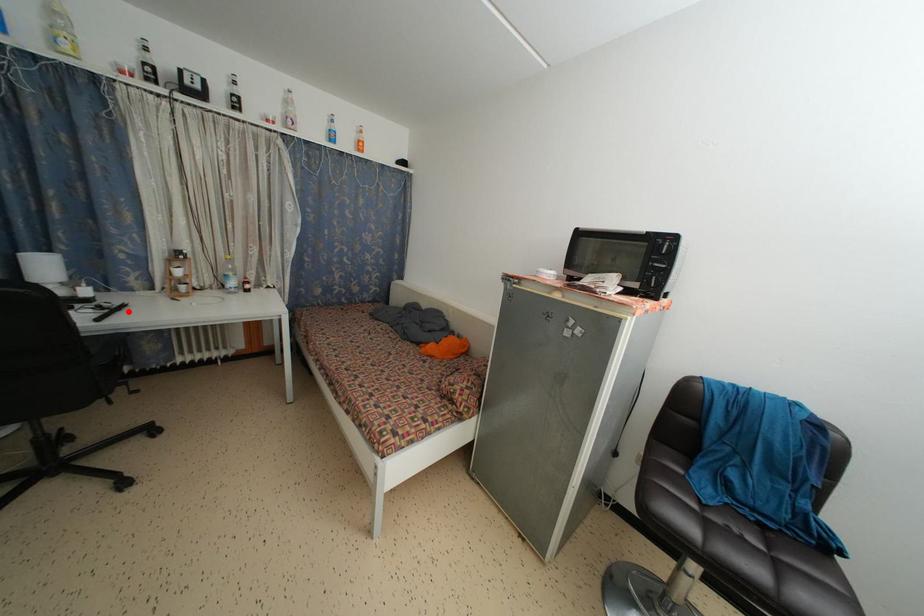
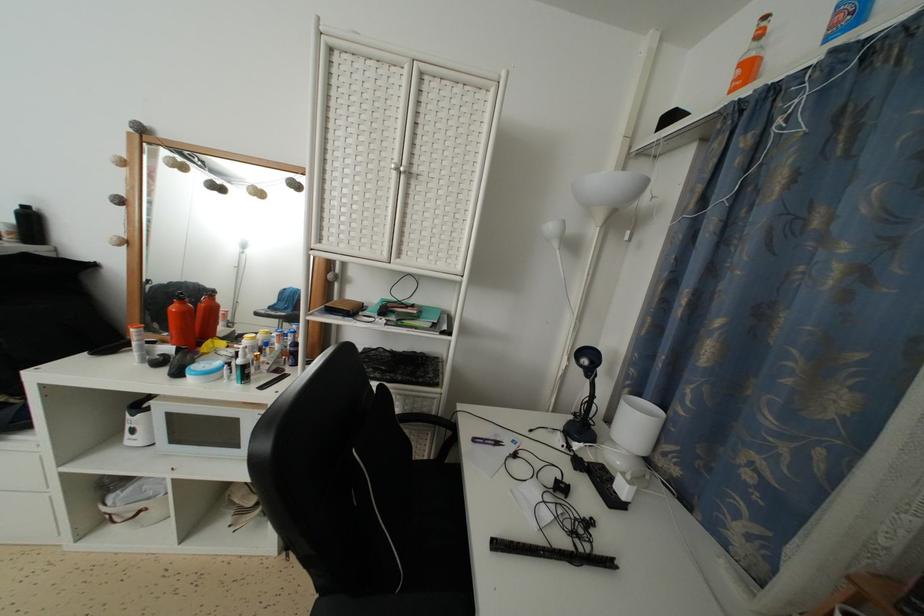
Find the pixel in the second image that matches the highlighted location in the first image.

(614, 569)